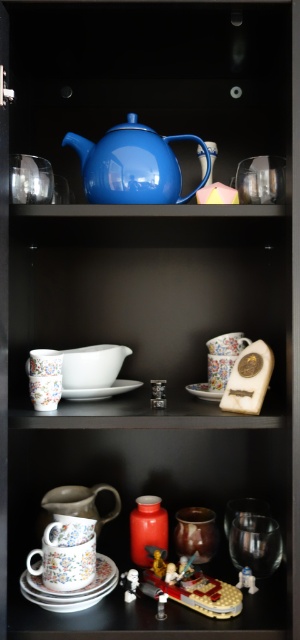
Question: Can you confirm if blue glossy teapot at upper center is smaller than white matte saucer at center?

Choices:
 (A) no
 (B) yes

Answer: (A)

Question: Considering the real-world distances, which object is farthest from the white glossy saucer at center?

Choices:
 (A) floral ceramic saucer at lower center
 (B) white matte saucer at center
 (C) blue glossy teapot at upper center

Answer: (C)

Question: Can you confirm if blue glossy teapot at upper center is positioned to the left of white matte saucer at center?

Choices:
 (A) yes
 (B) no

Answer: (B)

Question: Which of the following is the closest to the observer?

Choices:
 (A) (206, 392)
 (B) (63, 394)
 (C) (111, 570)

Answer: (B)

Question: Is floral ceramic saucer at lower center to the left of white matte saucer at center from the viewer's perspective?

Choices:
 (A) no
 (B) yes

Answer: (B)

Question: Which point is closer to the camera?

Choices:
 (A) (96, 586)
 (B) (75, 392)
 (C) (168, 157)
 (D) (198, 396)

Answer: (A)